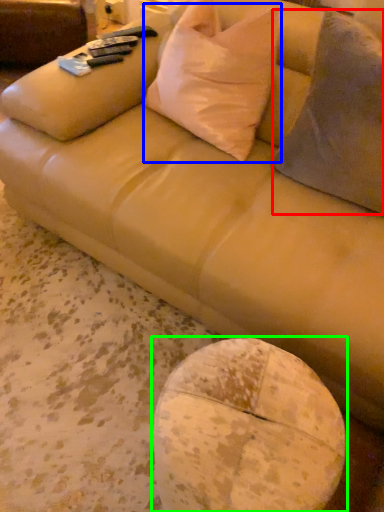
Question: Which is farther away from throw pillow (highlighted by a red box)? throw pillow (highlighted by a blue box) or round table (highlighted by a green box)?

Choices:
 (A) throw pillow
 (B) round table

Answer: (B)